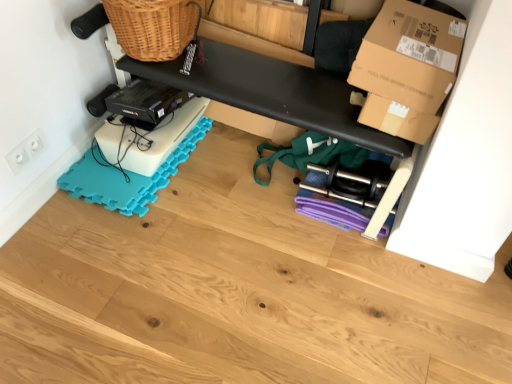
This screenshot has height=384, width=512. I want to click on free space in front of teal foam yoga mat at lower left, so click(x=136, y=258).